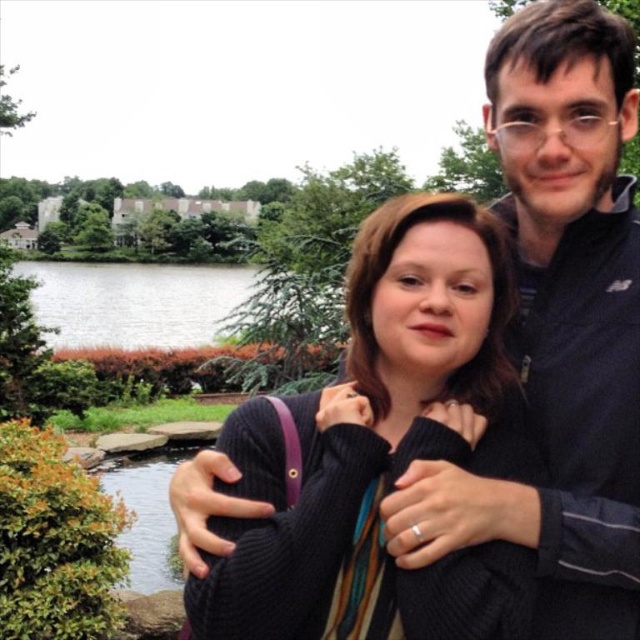
Question: Is black sweater at center bigger than green grass at lower left?

Choices:
 (A) yes
 (B) no

Answer: (B)

Question: Is black sweater at center to the left of green grass at lower left from the viewer's perspective?

Choices:
 (A) no
 (B) yes

Answer: (A)

Question: Which point appears farthest from the camera in this image?

Choices:
 (A) (246, 541)
 (B) (96, 282)

Answer: (B)

Question: Can you confirm if black sweater at center is smaller than green grass at lower left?

Choices:
 (A) yes
 (B) no

Answer: (A)